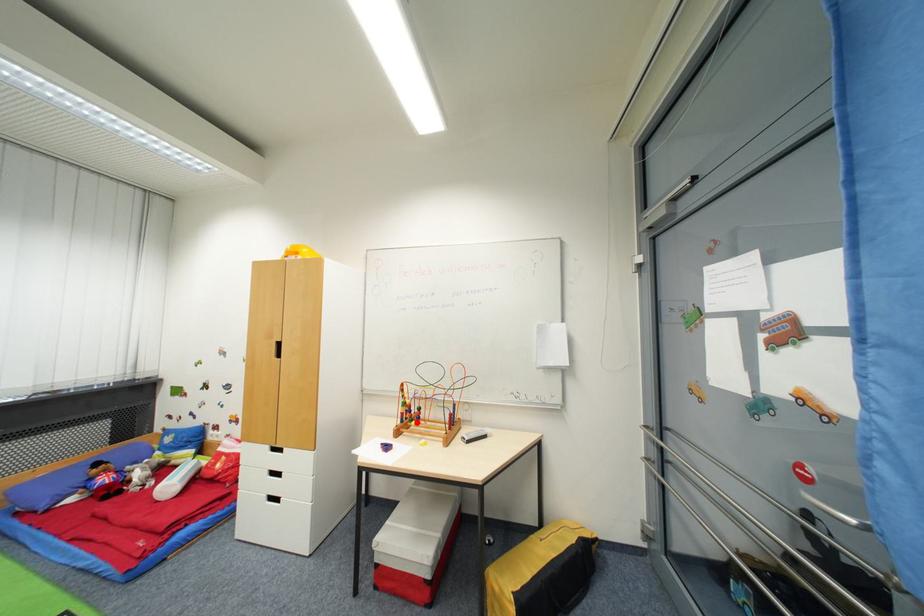
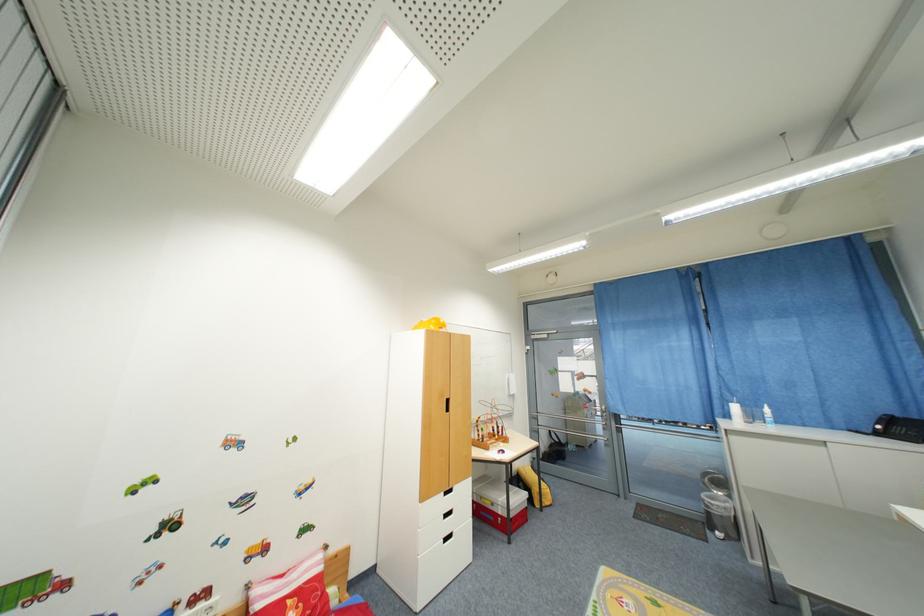
Locate, in the second image, the point that corresponds to the highlighted location in the first image.

(500, 438)